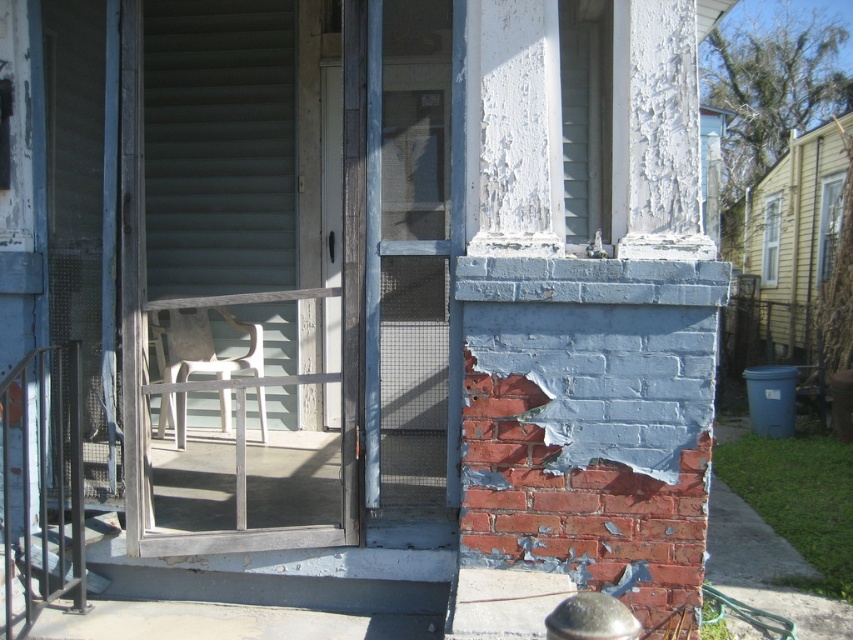
Who is lower down, gray wood screen door at center or white plastic chair at center?

white plastic chair at center is lower down.

Is point (358, 36) closer to camera compared to point (163, 420)?

Yes.

The image size is (853, 640). Find the location of `gray wood screen door at center`. gray wood screen door at center is located at coordinates (242, 268).